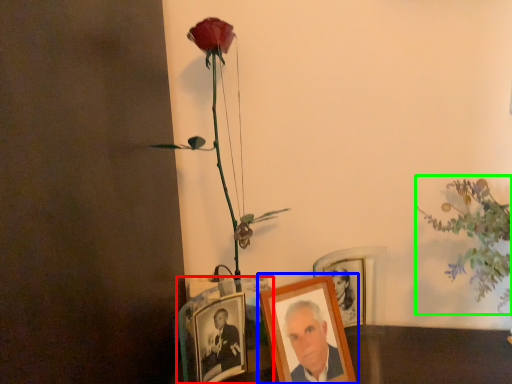
Question: Which object is positioned farthest from picture frame (highlighted by a red box)? Select from picture frame (highlighted by a blue box) and floral arrangement (highlighted by a green box).

Choices:
 (A) picture frame
 (B) floral arrangement

Answer: (B)